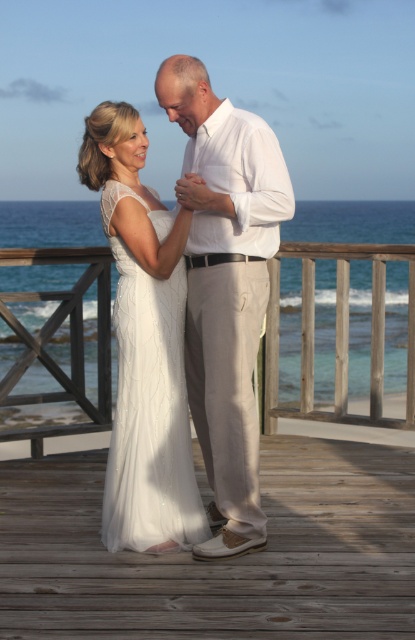
Is white cotton shirt at center shorter than white lace dress at center?

No, white cotton shirt at center is not shorter than white lace dress at center.

Does white cotton shirt at center have a greater width compared to white lace dress at center?

Correct, the width of white cotton shirt at center exceeds that of white lace dress at center.

Is point (276, 241) positioned behind point (182, 541)?

No, (276, 241) is in front of (182, 541).

Locate an element on the screen. Image resolution: width=415 pixels, height=640 pixels. white cotton shirt at center is located at coordinates (226, 288).

Which is in front, point (319, 547) or point (127, 442)?

Positioned in front is point (127, 442).

Who is positioned more to the right, wooden at center or white lace dress at center?

wooden at center

Identify the location of wooden at center. The image size is (415, 640). (265, 506).

Does wooden at center appear under white cotton shirt at center?

Indeed, wooden at center is positioned under white cotton shirt at center.

This screenshot has width=415, height=640. What do you see at coordinates (265, 506) in the screenshot?
I see `wooden at center` at bounding box center [265, 506].

Identify the location of wooden at center. (265, 506).